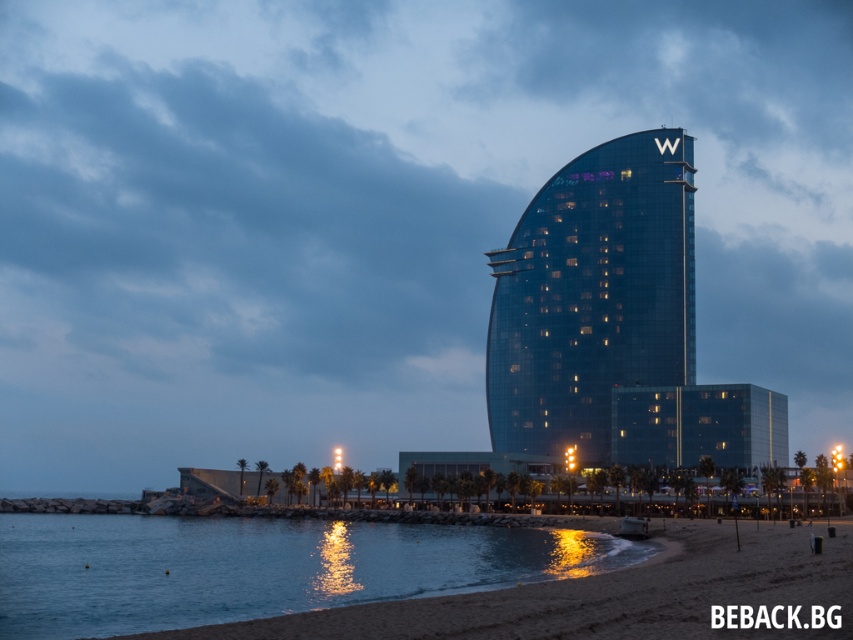
Question: In this image, where is blue glassy water at lower left located relative to glassy blue building at center?

Choices:
 (A) right
 (B) left

Answer: (B)

Question: Which point is farther to the camera?

Choices:
 (A) (416, 566)
 (B) (585, 308)

Answer: (B)

Question: Which point appears closest to the camera in this image?

Choices:
 (A) (537, 392)
 (B) (135, 516)
 (C) (621, 413)

Answer: (B)

Question: Among these objects, which one is farthest from the camera?

Choices:
 (A) transparent glass tower at center
 (B) glassy blue building at center

Answer: (A)

Question: Where is transparent glass tower at center located in relation to glassy blue building at center in the image?

Choices:
 (A) below
 (B) above

Answer: (B)

Question: Is transparent glass tower at center above glassy blue building at center?

Choices:
 (A) yes
 (B) no

Answer: (A)